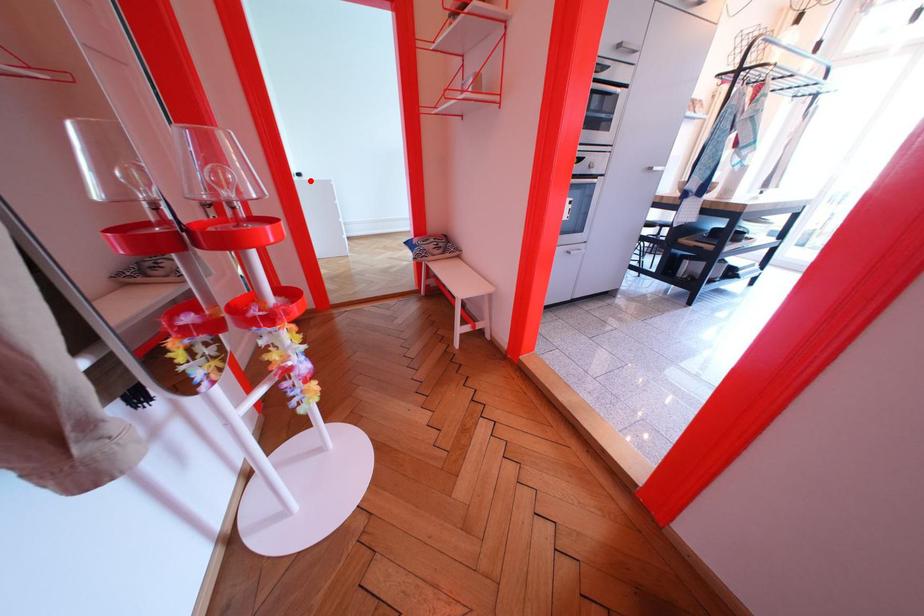
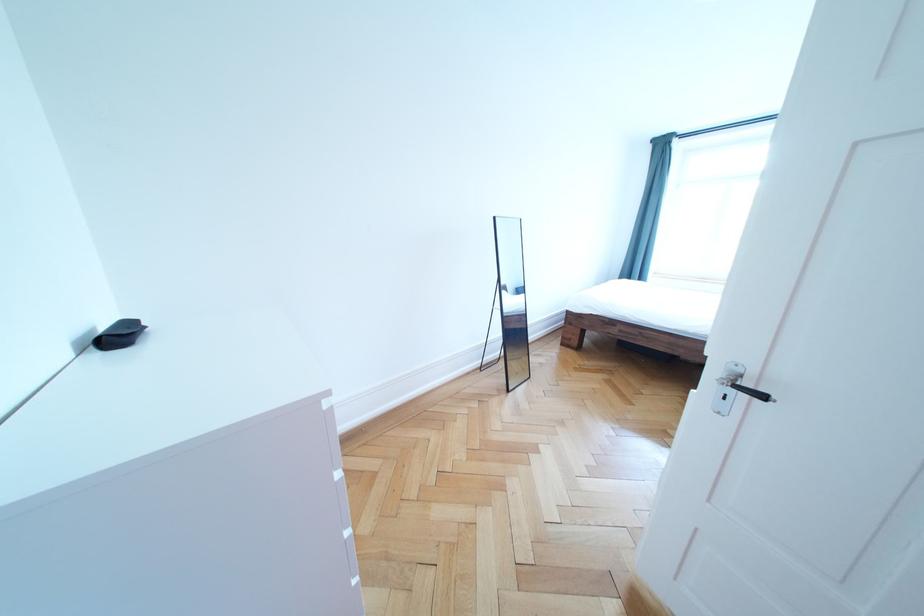
Find the pixel in the second image that matches the highlighted location in the first image.

(128, 344)